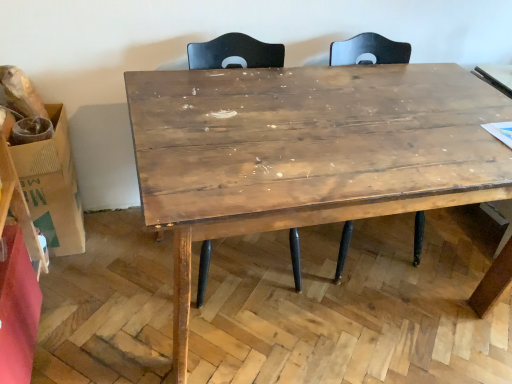
Where is `free spot to the right of brown cardboard box at left`? free spot to the right of brown cardboard box at left is located at coordinates (113, 246).